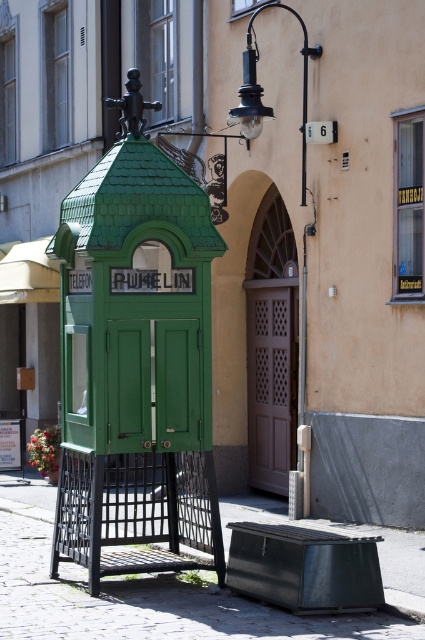
You are a city planner assessing the space in front of the green matte telephone booth at center and the green metal bench at lower center. Which object occupies more space in the scene?

The green matte telephone booth at center is bigger than the green metal bench at lower center, so it occupies more space in the scene.

You are a tourist standing in the middle of the cobblestone street and see the green matte telephone booth at center and the green metal bench at lower center. Which object is closer to your left side?

The green metal bench at lower center is closer to your left side because the green matte telephone booth at center is positioned to its right.

You are standing in front of the vintage green telephone booth on the cobblestone street. You notice two points marked in the scene. The first point is at coordinate point (85, 452) and the second is at coordinate point (232, 109). Which point is closer to you?

Point (85, 452) is closer to the viewer than point (232, 109).